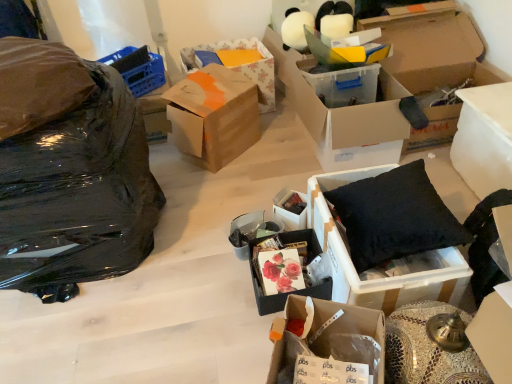
I want to click on cardboard box at center, the 5th box in the right-to-left sequence, so click(x=329, y=344).

Measure the distance between white plastic container at right, which is the 1th box in right-to-left order, and camera.

The depth of white plastic container at right, which is the 1th box in right-to-left order, is 1.72 meters.

What do you see at coordinates (484, 138) in the screenshot? Image resolution: width=512 pixels, height=384 pixels. I see `white plastic container at right, the ninth box positioned from the left` at bounding box center [484, 138].

Locate an element on the screen. This screenshot has height=384, width=512. matte black box at center, placed as the 4th box when sorted from left to right is located at coordinates 291,208.

The width and height of the screenshot is (512, 384). What do you see at coordinates (291, 208) in the screenshot?
I see `matte black box at center, the sixth box positioned from the right` at bounding box center [291, 208].

What are the coordinates of `black plastic bag at left` in the screenshot? It's located at (70, 168).

The width and height of the screenshot is (512, 384). What do you see at coordinates (244, 66) in the screenshot?
I see `floral paper box at center, marked as the 8th box in a right-to-left arrangement` at bounding box center [244, 66].

Where is `brown cardboard box at center, placed as the first box when sorted from left to right`? This screenshot has height=384, width=512. brown cardboard box at center, placed as the first box when sorted from left to right is located at coordinates (213, 116).

The image size is (512, 384). Find the location of `black fabric cushion at right, positioned as the 6th box in left-to-right order`. black fabric cushion at right, positioned as the 6th box in left-to-right order is located at coordinates tap(392, 260).

The width and height of the screenshot is (512, 384). Identify the location of cardboard box at center, the 5th box in the right-to-left sequence. (329, 344).

At what (x,y) coordinates should I click in order to perform the action: click on box that is the 6th one above the black fabric cushion at right, positioned as the 6th box in left-to-right order (from a real-world perspective). Please return your answer as a coordinate pair (x, y). The height and width of the screenshot is (384, 512). Looking at the image, I should click on 430,49.

Is cardboard box at upper right, the 8th box from the left, inside the boundaries of black fabric cushion at right, positioned as the 6th box in left-to-right order, or outside?

cardboard box at upper right, the 8th box from the left, is located beyond the bounds of black fabric cushion at right, positioned as the 6th box in left-to-right order.

Consider the image. Can you confirm if cardboard box at upper right, arranged as the second box when viewed from the right, is smaller than black fabric cushion at right, the 4th box positioned from the right?

No, cardboard box at upper right, arranged as the second box when viewed from the right, is not smaller than black fabric cushion at right, the 4th box positioned from the right.

Are cardboard box at upper right, arranged as the second box when viewed from the right, and black fabric cushion at right, the 4th box positioned from the right, far apart?

Yes.

Based on their positions, is matte black box at center, placed as the 4th box when sorted from left to right, located to the left or right of black plastic bag at left?

matte black box at center, placed as the 4th box when sorted from left to right, is positioned on black plastic bag at left's right side.

From their relative heights in the image, would you say matte black box at center, placed as the 4th box when sorted from left to right, is taller or shorter than black plastic bag at left?

matte black box at center, placed as the 4th box when sorted from left to right, is shorter than black plastic bag at left.

Are matte black box at center, placed as the 4th box when sorted from left to right, and black plastic bag at left beside each other?

No, matte black box at center, placed as the 4th box when sorted from left to right, is not beside black plastic bag at left.

Would you say matte black box at center, the sixth box positioned from the right, is inside or outside black plastic bag at left?

matte black box at center, the sixth box positioned from the right, lies outside black plastic bag at left.

You are a GUI agent. You are given a task and a screenshot of the screen. Output one action in this format:
    pyautogui.click(x=<x>, y=<y>)
    Task: Click on the 2nd box above the white plastic container at right, which is the 1th box in right-to-left order (from a real-world perspective)
    
    Given the screenshot: What is the action you would take?
    pyautogui.click(x=430, y=49)

Which object is further away from the camera taking this photo, white plastic container at right, the ninth box positioned from the left, or cardboard box at upper right, arranged as the second box when viewed from the right?

Positioned behind is cardboard box at upper right, arranged as the second box when viewed from the right.

From the picture: How many degrees apart are the facing directions of white plastic container at right, the ninth box positioned from the left, and cardboard box at upper right, arranged as the second box when viewed from the right?

They differ by 89.9 degrees in their facing directions.

From the image's perspective, which box is the 5th one below the brown cardboard box at center, placed as the first box when sorted from left to right? Please provide its 2D coordinates.

[(329, 344)]

Is cardboard box at center, which is the 5th box in left-to-right order, aimed at brown cardboard box at center, which ranks as the ninth box in right-to-left order?

No, cardboard box at center, which is the 5th box in left-to-right order, does not turn towards brown cardboard box at center, which ranks as the ninth box in right-to-left order.

Is cardboard box at center, which is the 5th box in left-to-right order, bigger than brown cardboard box at center, which ranks as the ninth box in right-to-left order?

Actually, cardboard box at center, which is the 5th box in left-to-right order, might be smaller than brown cardboard box at center, which ranks as the ninth box in right-to-left order.

Which object is positioned more to the right, cardboard box at center, which is the 5th box in left-to-right order, or brown cardboard box at center, placed as the first box when sorted from left to right?

cardboard box at center, which is the 5th box in left-to-right order, is more to the right.

Considering the positions of objects white plastic container at right, which is the 1th box in right-to-left order, and black fabric cushion at right, the 4th box positioned from the right, in the image provided, who is more to the left, white plastic container at right, which is the 1th box in right-to-left order, or black fabric cushion at right, the 4th box positioned from the right,?

From the viewer's perspective, black fabric cushion at right, the 4th box positioned from the right, appears more on the left side.

Could you tell me if white plastic container at right, which is the 1th box in right-to-left order, is facing black fabric cushion at right, positioned as the 6th box in left-to-right order?

Yes, white plastic container at right, which is the 1th box in right-to-left order, is aimed at black fabric cushion at right, positioned as the 6th box in left-to-right order.

Is white plastic container at right, which is the 1th box in right-to-left order, spatially inside black fabric cushion at right, positioned as the 6th box in left-to-right order, or outside of it?

white plastic container at right, which is the 1th box in right-to-left order, is located beyond the bounds of black fabric cushion at right, positioned as the 6th box in left-to-right order.

Are white plastic container at right, the ninth box positioned from the left, and matte floral print box at center, acting as the seventh box starting from the right, far apart?

They are positioned close to each other.

Considering the relative sizes of white plastic container at right, the ninth box positioned from the left, and matte floral print box at center, the third box in the left-to-right sequence, in the image provided, is white plastic container at right, the ninth box positioned from the left, wider than matte floral print box at center, the third box in the left-to-right sequence,?

Yes.

Considering the points (500, 148) and (257, 240), which point is in front, point (500, 148) or point (257, 240)?

The point (257, 240) is closer.

Is white plastic container at right, the ninth box positioned from the left, not inside matte floral print box at center, acting as the seventh box starting from the right?

Absolutely, white plastic container at right, the ninth box positioned from the left, is external to matte floral print box at center, acting as the seventh box starting from the right.

From a real-world perspective, is white plastic container at right, the ninth box positioned from the left, physically located above or below cardboard box at center, which is the 5th box in left-to-right order?

In terms of real-world spatial position, white plastic container at right, the ninth box positioned from the left, is above cardboard box at center, which is the 5th box in left-to-right order.

Would you say white plastic container at right, which is the 1th box in right-to-left order, contains cardboard box at center, which is the 5th box in left-to-right order?

Definitely not — cardboard box at center, which is the 5th box in left-to-right order, is not inside white plastic container at right, which is the 1th box in right-to-left order.

Is white plastic container at right, which is the 1th box in right-to-left order, turned away from cardboard box at center, which is the 5th box in left-to-right order?

That's not correct — white plastic container at right, which is the 1th box in right-to-left order, is not looking away from cardboard box at center, which is the 5th box in left-to-right order.

How far apart are white plastic container at right, the ninth box positioned from the left, and cardboard box at center, which is the 5th box in left-to-right order?

white plastic container at right, the ninth box positioned from the left, and cardboard box at center, which is the 5th box in left-to-right order, are 3.69 feet apart.

Where is `the 5th box behind the black fabric cushion at right, the 4th box positioned from the right`? The width and height of the screenshot is (512, 384). the 5th box behind the black fabric cushion at right, the 4th box positioned from the right is located at coordinates (430, 49).

From a real-world perspective, count 8th boxs downward from the black plastic bag at left and point to it. Please provide its 2D coordinates.

[(291, 208)]

Estimate the real-world distances between objects in this image. Which object is further from cardboard box at center, the 5th box in the right-to-left sequence, black plastic bag at left or cardboard box at upper right, arranged as the second box when viewed from the right?

Based on the image, cardboard box at upper right, arranged as the second box when viewed from the right, appears to be further to cardboard box at center, the 5th box in the right-to-left sequence.

Based on their spatial positions, is transparent plastic box at center, acting as the seventh box starting from the left, or black plastic bag at left further from matte floral print box at center, acting as the seventh box starting from the right?

transparent plastic box at center, acting as the seventh box starting from the left, is further to matte floral print box at center, acting as the seventh box starting from the right.

Which object lies nearer to the anchor point matte black box at center, placed as the 4th box when sorted from left to right, brown cardboard box at center, which ranks as the ninth box in right-to-left order, or matte floral print box at center, acting as the seventh box starting from the right?

matte floral print box at center, acting as the seventh box starting from the right, is positioned closer to the anchor matte black box at center, placed as the 4th box when sorted from left to right.

Considering their positions, is black fabric cushion at right, the 4th box positioned from the right, positioned further to cardboard box at center, which is the 5th box in left-to-right order, than matte black box at center, placed as the 4th box when sorted from left to right?

matte black box at center, placed as the 4th box when sorted from left to right, is further to cardboard box at center, which is the 5th box in left-to-right order.

From the image, which object appears to be farther from brown cardboard box at center, which ranks as the ninth box in right-to-left order, matte floral print box at center, acting as the seventh box starting from the right, or floral paper box at center, marked as the 8th box in a right-to-left arrangement?

Based on the image, matte floral print box at center, acting as the seventh box starting from the right, appears to be further to brown cardboard box at center, which ranks as the ninth box in right-to-left order.

Which object lies nearer to the anchor point cardboard box at center, the 5th box in the right-to-left sequence, cardboard box at upper right, the 8th box from the left, or matte floral print box at center, acting as the seventh box starting from the right?

matte floral print box at center, acting as the seventh box starting from the right, is positioned closer to the anchor cardboard box at center, the 5th box in the right-to-left sequence.

From the image, which object appears to be farther from brown cardboard box at center, which ranks as the ninth box in right-to-left order, transparent plastic box at center, acting as the seventh box starting from the left, or white plastic container at right, the ninth box positioned from the left?

Among the two, white plastic container at right, the ninth box positioned from the left, is located further to brown cardboard box at center, which ranks as the ninth box in right-to-left order.

Considering their positions, is black fabric cushion at right, positioned as the 6th box in left-to-right order, positioned closer to transparent plastic box at center, which ranks as the 3th box in right-to-left order, than cardboard box at upper right, arranged as the second box when viewed from the right?

Based on the image, cardboard box at upper right, arranged as the second box when viewed from the right, appears to be nearer to transparent plastic box at center, which ranks as the 3th box in right-to-left order.

In order to click on garbage between cardboard box at center, which is the 5th box in left-to-right order, and floral paper box at center, marked as the 8th box in a right-to-left arrangement, along the z-axis in this screenshot , I will do `click(70, 168)`.

The height and width of the screenshot is (384, 512). I want to click on box between cardboard box at center, which is the 5th box in left-to-right order, and matte floral print box at center, the third box in the left-to-right sequence, from front to back, so click(x=392, y=260).

The width and height of the screenshot is (512, 384). Identify the location of box between transparent plastic box at center, which ranks as the 3th box in right-to-left order, and white plastic container at right, which is the 1th box in right-to-left order, from left to right. (430, 49).